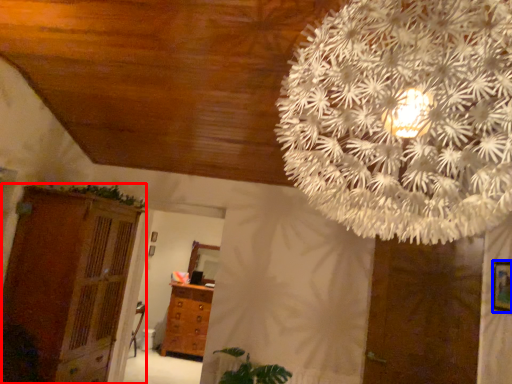
Question: Which object is closer to the camera taking this photo, dresser (highlighted by a red box) or picture frame (highlighted by a blue box)?

Choices:
 (A) dresser
 (B) picture frame

Answer: (B)